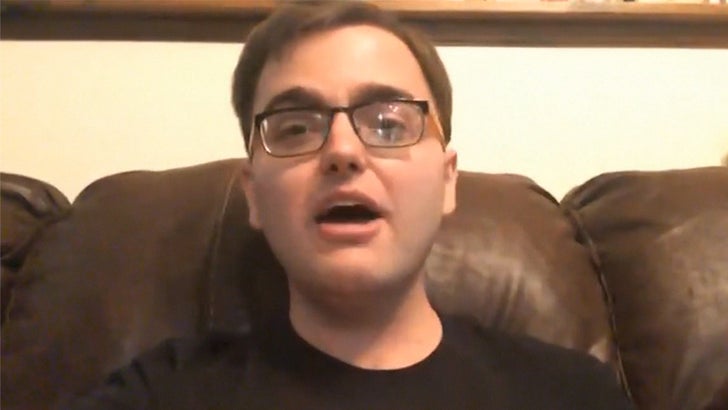
Locate an element on the screen. brown leather couch is located at coordinates (536, 267).